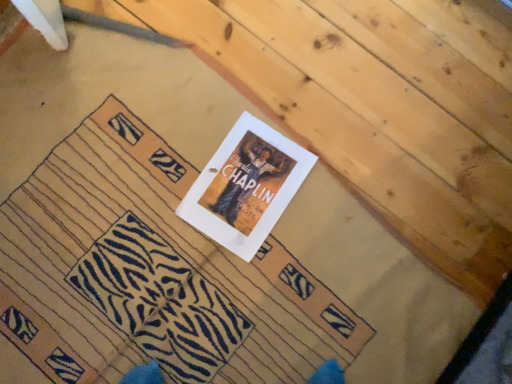
Where is `white paper at center`? white paper at center is located at coordinates (151, 274).

Describe the element at coordinates (151, 274) in the screenshot. I see `white paper at center` at that location.

Identify the location of white paper at center. Image resolution: width=512 pixels, height=384 pixels. (151, 274).